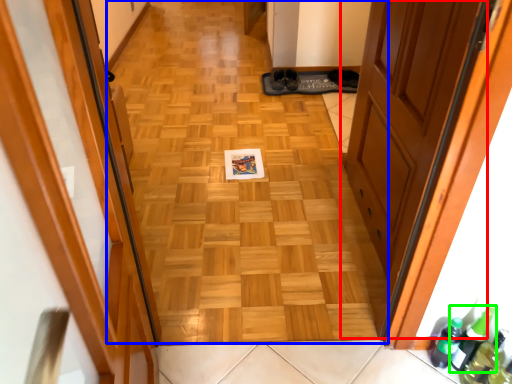
Question: Which object is positioned closest to door (highlighted by a red box)? Select from plain (highlighted by a blue box) and beer bottle (highlighted by a green box).

Choices:
 (A) plain
 (B) beer bottle

Answer: (A)